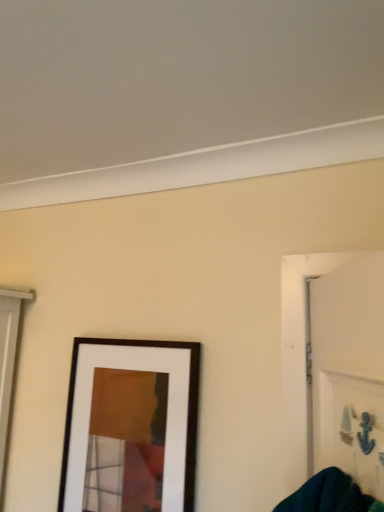
Image resolution: width=384 pixels, height=512 pixels. What do you see at coordinates (131, 426) in the screenshot?
I see `matte black picture frame at center-left` at bounding box center [131, 426].

Measure the distance between point (164, 502) and camera.

Point (164, 502) and camera are 4.19 feet apart from each other.

Where is `matte black picture frame at center-left`? matte black picture frame at center-left is located at coordinates (x=131, y=426).

I want to click on matte black picture frame at center-left, so click(131, 426).